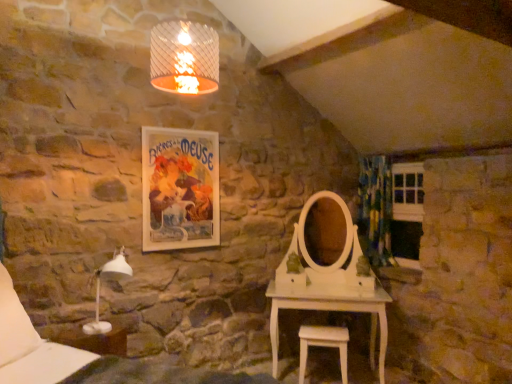
Question: Considering the relative sizes of white plastic table lamp at lower left and green floral fabric curtain at right in the image provided, is white plastic table lamp at lower left taller than green floral fabric curtain at right?

Choices:
 (A) no
 (B) yes

Answer: (A)

Question: Is white plastic table lamp at lower left at the left side of green floral fabric curtain at right?

Choices:
 (A) yes
 (B) no

Answer: (A)

Question: From a real-world perspective, is white plastic table lamp at lower left physically below green floral fabric curtain at right?

Choices:
 (A) yes
 (B) no

Answer: (A)

Question: Is white plastic table lamp at lower left touching green floral fabric curtain at right?

Choices:
 (A) no
 (B) yes

Answer: (A)

Question: Considering the relative positions of white plastic table lamp at lower left and green floral fabric curtain at right in the image provided, is white plastic table lamp at lower left behind green floral fabric curtain at right?

Choices:
 (A) no
 (B) yes

Answer: (A)

Question: Is the position of white plastic table lamp at lower left less distant than that of green floral fabric curtain at right?

Choices:
 (A) yes
 (B) no

Answer: (A)

Question: Is matte paper poster at upper center bigger than white wooden window at right?

Choices:
 (A) yes
 (B) no

Answer: (B)

Question: Does matte paper poster at upper center have a smaller size compared to white wooden window at right?

Choices:
 (A) yes
 (B) no

Answer: (A)

Question: Are matte paper poster at upper center and white wooden window at right located far from each other?

Choices:
 (A) no
 (B) yes

Answer: (B)

Question: From a real-world perspective, is matte paper poster at upper center beneath white wooden window at right?

Choices:
 (A) no
 (B) yes

Answer: (A)

Question: Is matte paper poster at upper center shorter than white wooden window at right?

Choices:
 (A) no
 (B) yes

Answer: (B)

Question: Does matte paper poster at upper center contain white wooden window at right?

Choices:
 (A) no
 (B) yes

Answer: (A)

Question: Is white soft pillow at lower left facing towards white wood stool at lower center?

Choices:
 (A) no
 (B) yes

Answer: (A)